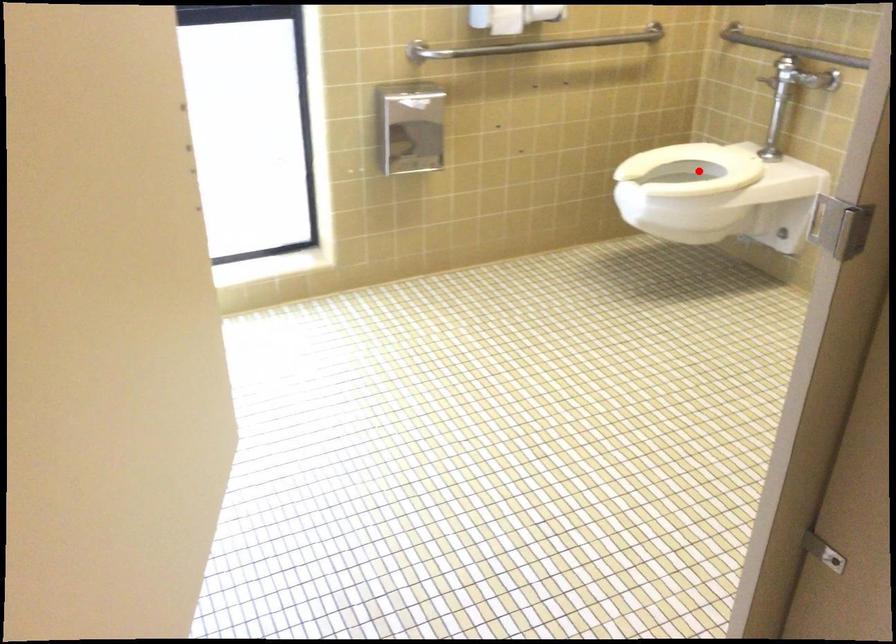
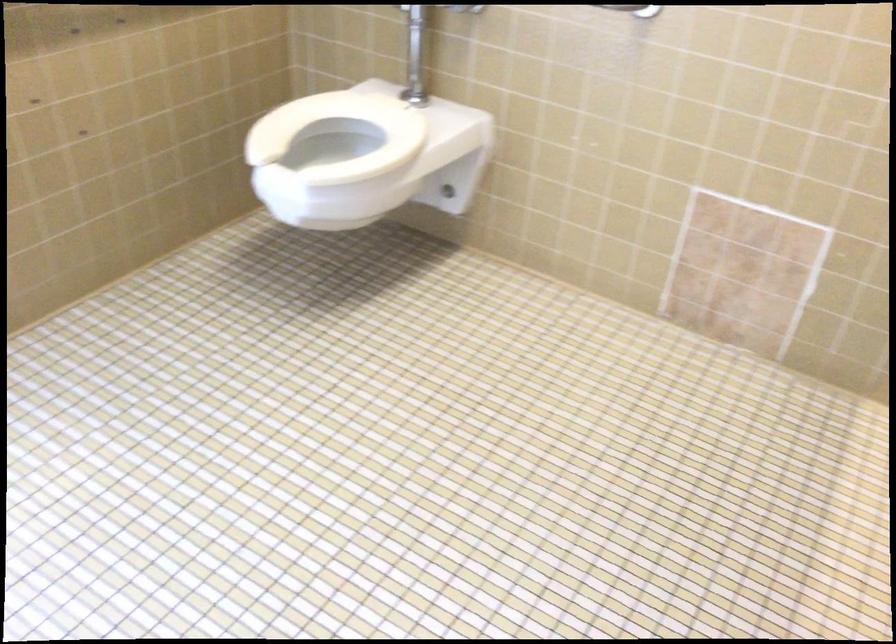
Question: I am providing you with two images of the same scene from different viewpoints. A red point is marked on the first image. At the location where the point appears in image 1, is it still visible in image 2?

Choices:
 (A) Yes
 (B) No

Answer: (A)